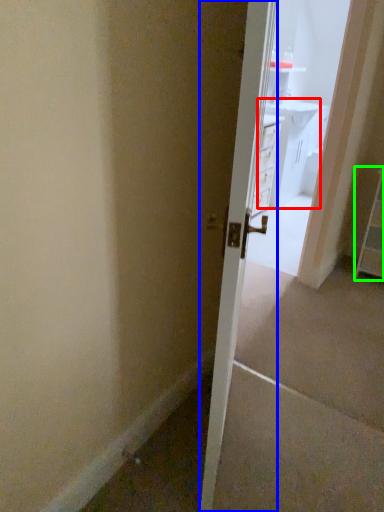
Question: Which object is positioned farthest from vanity (highlighted by a red box)? Select from door (highlighted by a blue box) and dresser (highlighted by a green box).

Choices:
 (A) door
 (B) dresser

Answer: (A)